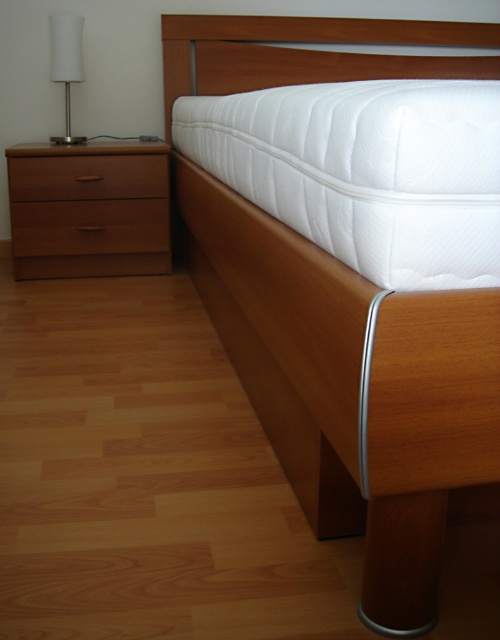
Question: Which point is farther to the camera?

Choices:
 (A) (133, 216)
 (B) (181, 52)
 (C) (216, 104)
 (D) (410, 429)

Answer: (B)

Question: Among these points, which one is nearest to the camera?

Choices:
 (A) (181, 29)
 (B) (65, 120)
 (C) (490, 268)
 (D) (70, 220)

Answer: (C)

Question: Can you confirm if light brown wood dresser at left is bigger than brown wood drawer at left?

Choices:
 (A) no
 (B) yes

Answer: (B)

Question: Can you confirm if brown wood drawer at left is positioned above white matte lamp at left?

Choices:
 (A) no
 (B) yes

Answer: (A)

Question: Which point is farther to the camera?

Choices:
 (A) brown wood drawer at left
 (B) light brown wood dresser at left

Answer: (A)

Question: Is wooden bed at center to the right of brown matte drawer at left from the viewer's perspective?

Choices:
 (A) no
 (B) yes

Answer: (B)